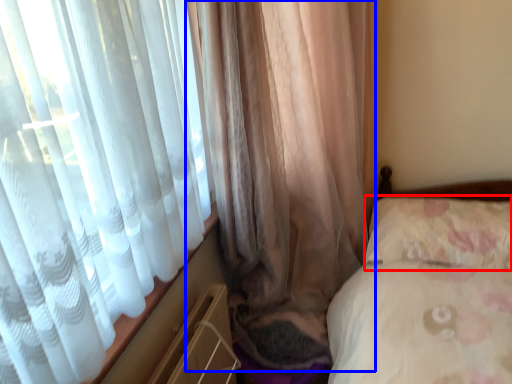
Question: Which of the following is the farthest to the observer, pillow (highlighted by a red box) or curtain (highlighted by a blue box)?

Choices:
 (A) pillow
 (B) curtain

Answer: (A)